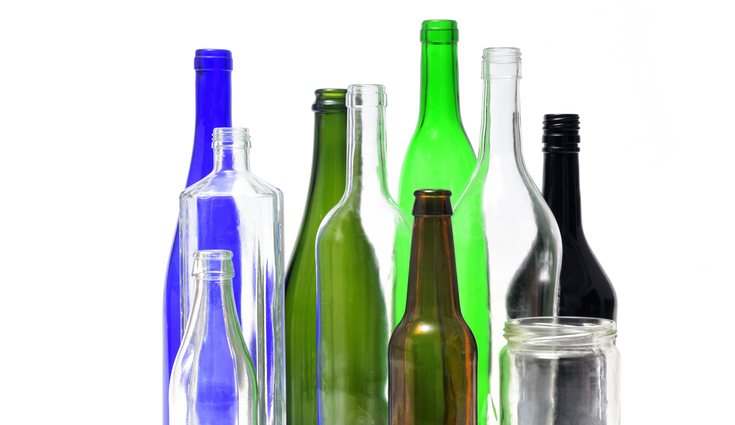
Find the location of a particular element. This screenshot has height=425, width=735. glass bottles (necks and tops) is located at coordinates (214, 94), (237, 204), (207, 355), (323, 162), (359, 264), (431, 311), (444, 124), (506, 221), (584, 280), (576, 385).